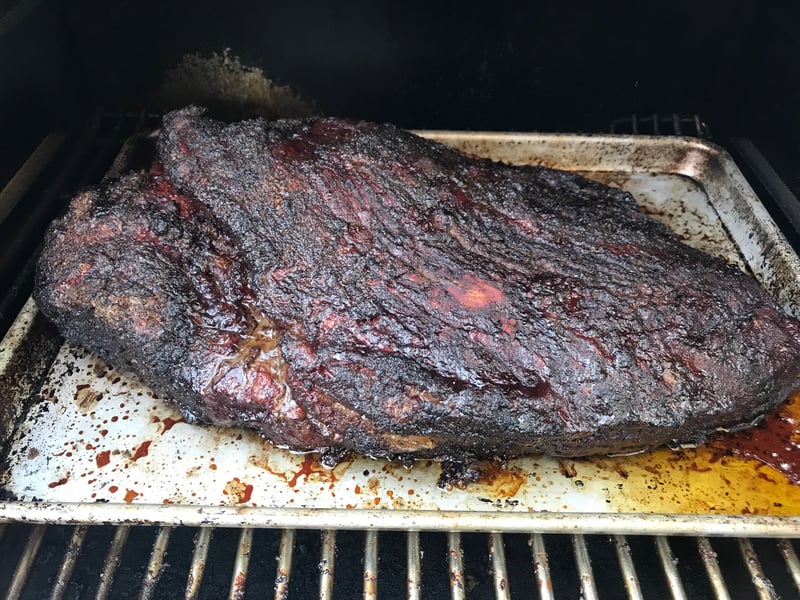
You are a GUI agent. You are given a task and a screenshot of the screen. Output one action in this format:
    pyautogui.click(x=<x>, y=<y>)
    Task: Click on the smoker walls
    
    Given the screenshot: What is the action you would take?
    pyautogui.click(x=488, y=7), pyautogui.click(x=780, y=80), pyautogui.click(x=9, y=71)